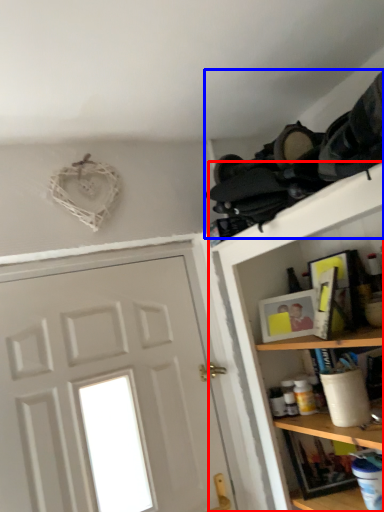
Question: Which object appears farthest to the camera in this image, shelf (highlighted by a red box) or laundry (highlighted by a blue box)?

Choices:
 (A) shelf
 (B) laundry

Answer: (B)